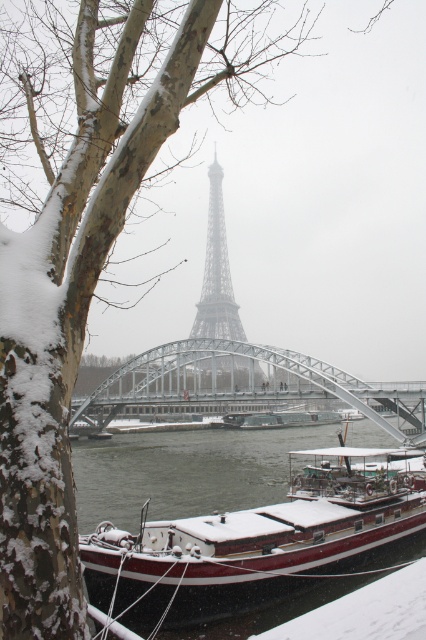
Question: Does snow-covered wooden boat at lower center have a greater width compared to metallic gray bridge at center?

Choices:
 (A) yes
 (B) no

Answer: (B)

Question: Which object appears closest to the camera in this image?

Choices:
 (A) snow-covered wooden boat at lower center
 (B) metallic gray bridge at center
 (C) metallic structure at center

Answer: (A)

Question: Which is nearer to the metallic gray bridge at center?

Choices:
 (A) snow-covered wooden boat at lower center
 (B) metallic structure at center

Answer: (B)

Question: Does snow-covered wooden boat at lower center have a smaller size compared to metallic gray bridge at center?

Choices:
 (A) yes
 (B) no

Answer: (A)

Question: Does snow-covered wooden boat at lower center have a lesser width compared to metallic structure at center?

Choices:
 (A) yes
 (B) no

Answer: (B)

Question: Considering the real-world distances, which object is farthest from the metallic gray bridge at center?

Choices:
 (A) metallic structure at center
 (B) snow-covered wooden boat at lower center

Answer: (B)